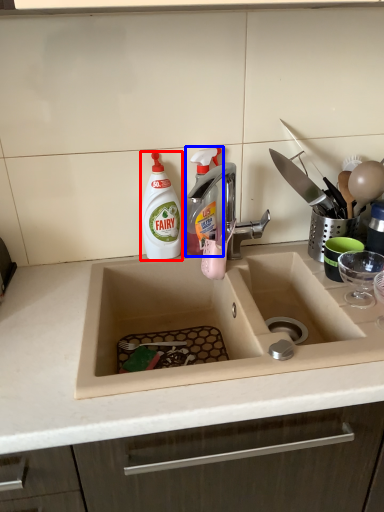
Question: Which of the following is the farthest to the observer, cleaning product (highlighted by a red box) or cleaning product (highlighted by a blue box)?

Choices:
 (A) cleaning product
 (B) cleaning product

Answer: (B)